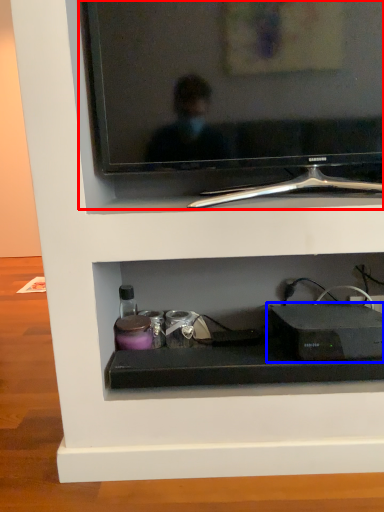
Question: Which object appears closest to the camera in this image, television (highlighted by a red box) or gadget (highlighted by a blue box)?

Choices:
 (A) television
 (B) gadget

Answer: (A)